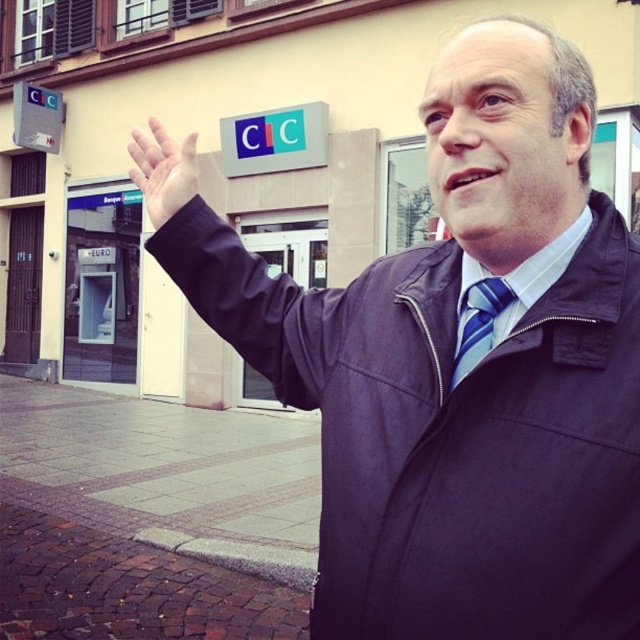
Question: Which of the following is the farthest from the observer?

Choices:
 (A) (157, 129)
 (B) (500, 294)

Answer: (A)

Question: Is black leather arm at upper center above matte black hand at upper left?

Choices:
 (A) no
 (B) yes

Answer: (A)

Question: Which of the following is the farthest from the observer?

Choices:
 (A) (156, 195)
 (B) (16, 122)

Answer: (B)

Question: Can you confirm if blue striped tie at center is smaller than metallic gray sign at upper left?

Choices:
 (A) yes
 (B) no

Answer: (A)

Question: Can you confirm if blue striped tie at center is thinner than metallic gray sign at upper left?

Choices:
 (A) yes
 (B) no

Answer: (A)

Question: Which object is farther from the camera taking this photo?

Choices:
 (A) matte black hand at upper left
 (B) black leather arm at upper center
 (C) metallic gray sign at upper left

Answer: (C)